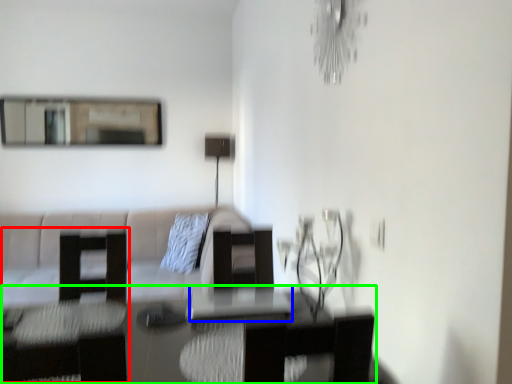
Question: Estimate the real-world distances between objects in this image. Which object is farther from swivel chair (highlighted by a red box), glass table (highlighted by a blue box) or table (highlighted by a green box)?

Choices:
 (A) glass table
 (B) table

Answer: (A)